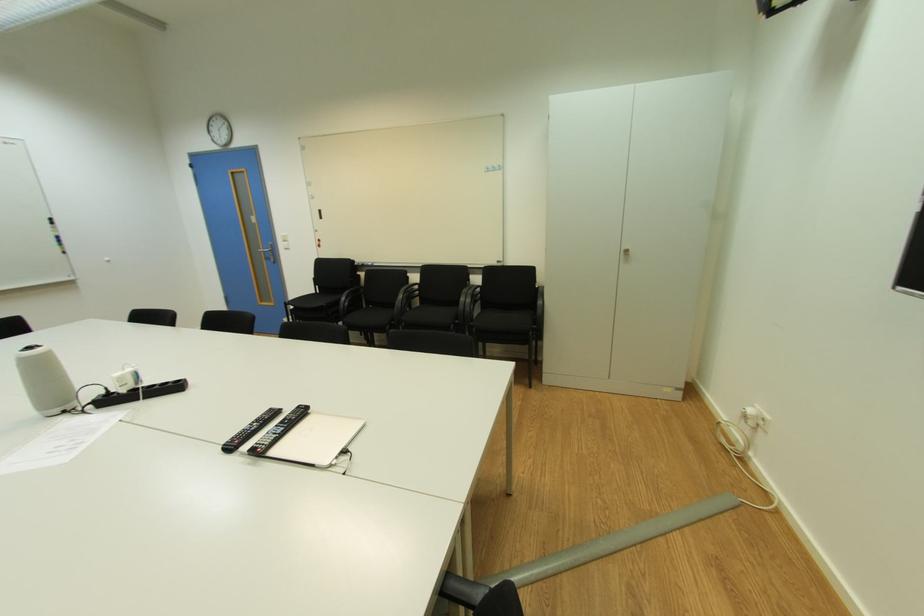
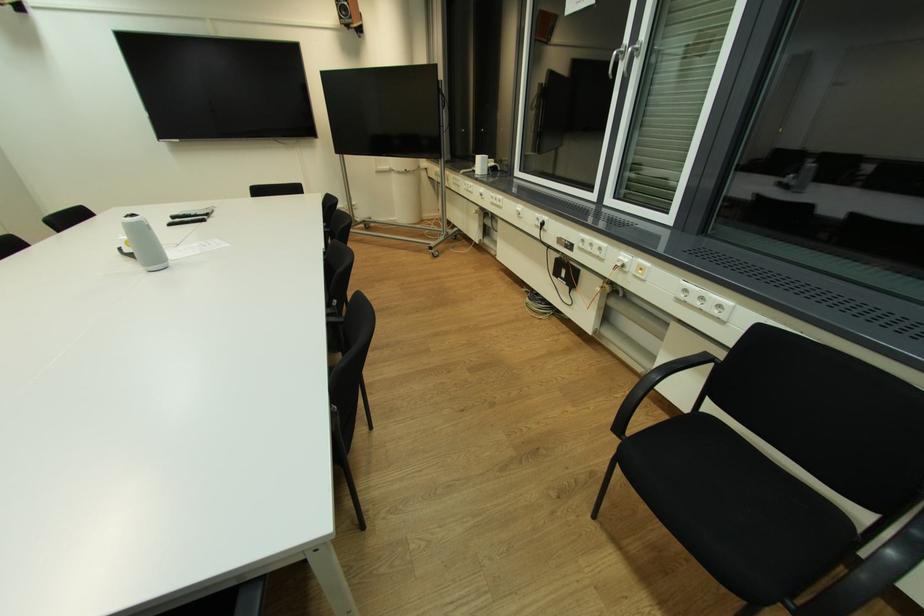
Find the pixel in the second image that matches pixel 34 349 in the first image.

(137, 216)